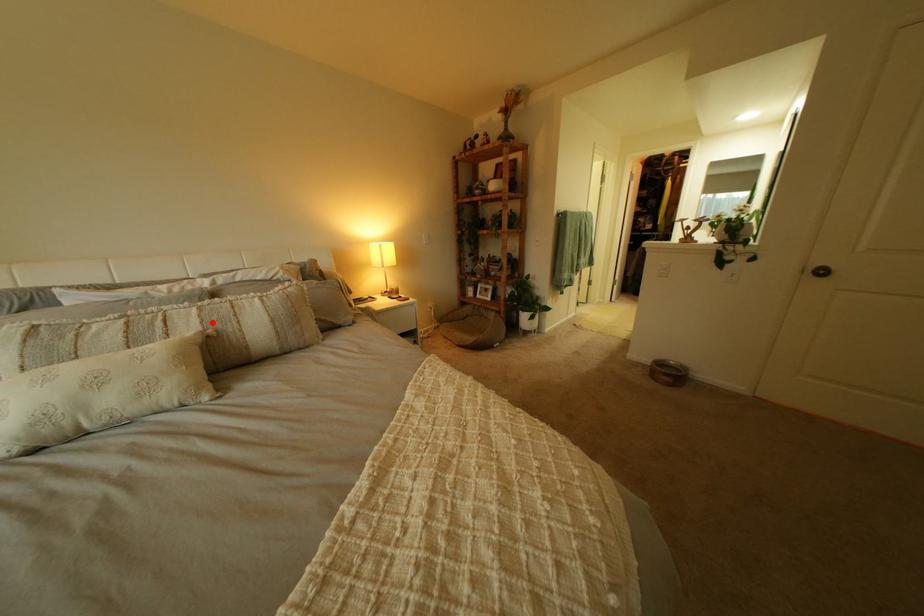
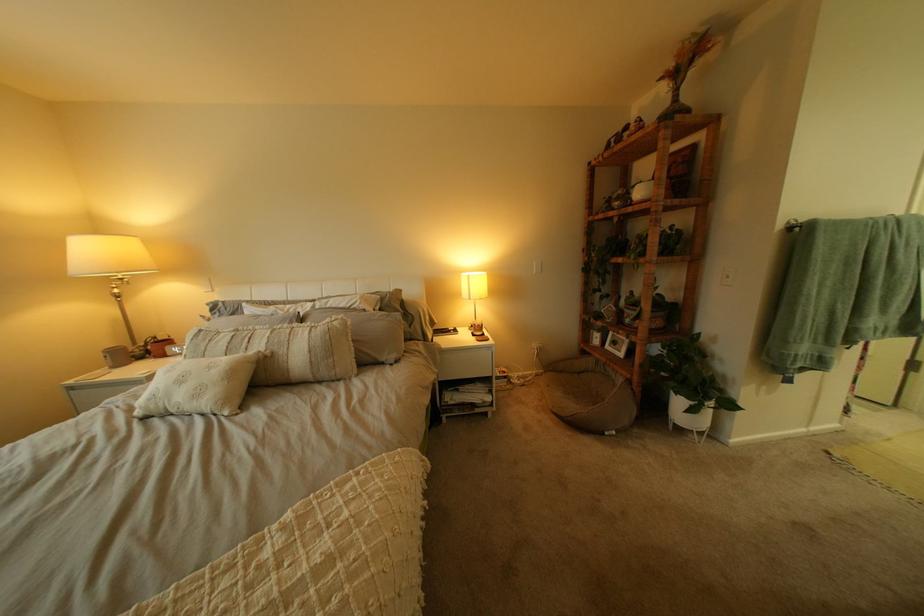
Locate, in the second image, the point that corresponds to the highlighted location in the first image.

(281, 342)